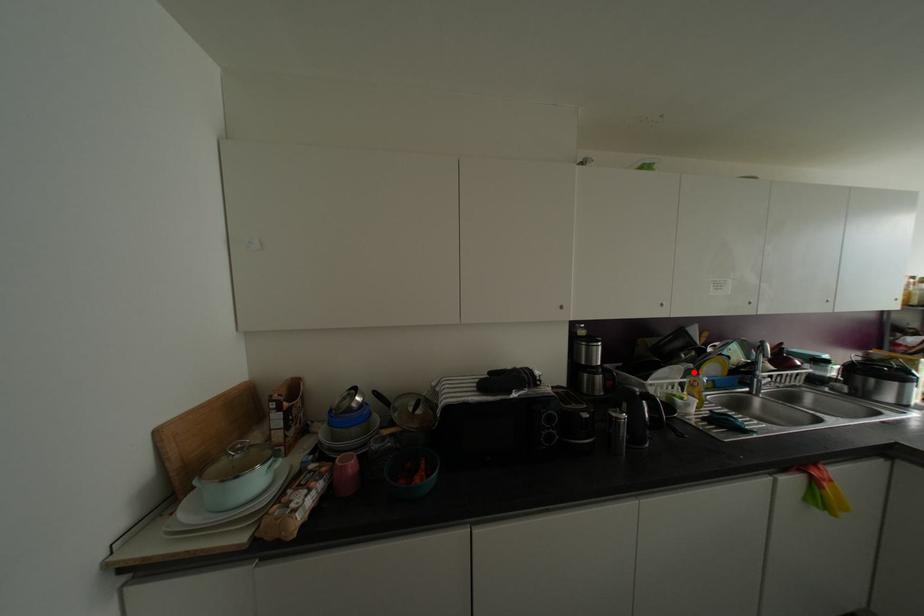
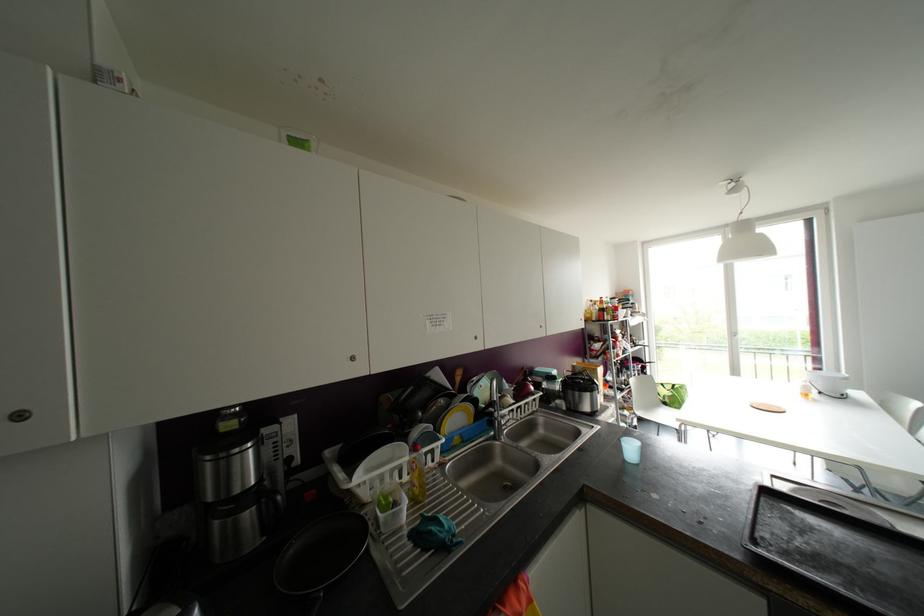
In the second image, find the point that corresponds to the highlighted location in the first image.

(414, 448)